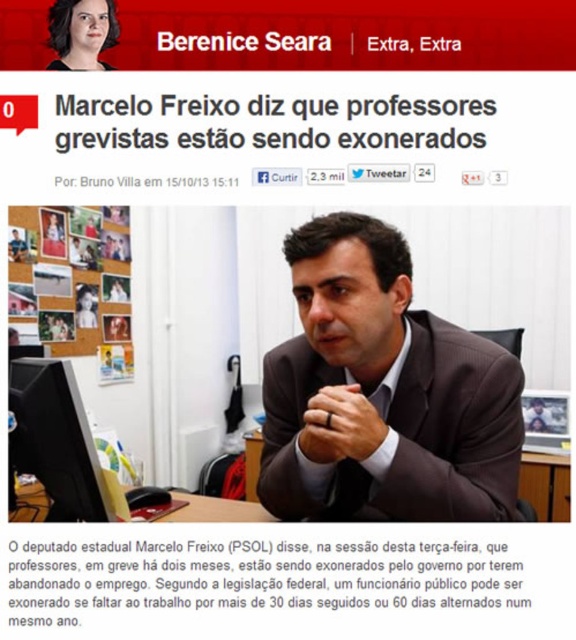
Question: Considering the relative positions of black paper text at center and matte black hair at upper left in the image provided, where is black paper text at center located with respect to matte black hair at upper left?

Choices:
 (A) left
 (B) right

Answer: (B)

Question: Observing the image, what is the correct spatial positioning of black paper text at center in reference to black glossy monitor at lower left?

Choices:
 (A) right
 (B) left

Answer: (A)

Question: Which point is closer to the camera?

Choices:
 (A) brown suit at center
 (B) black glossy monitor at lower left

Answer: (A)

Question: Among these points, which one is farthest from the camera?

Choices:
 (A) (374, 451)
 (B) (475, 548)
 (C) (107, 40)

Answer: (C)

Question: Can you confirm if black paper text at center is positioned to the right of matte black hair at upper left?

Choices:
 (A) yes
 (B) no

Answer: (A)

Question: Which of the following is the closest to the observer?

Choices:
 (A) (59, 416)
 (B) (52, 67)
 (C) (350, 518)

Answer: (A)